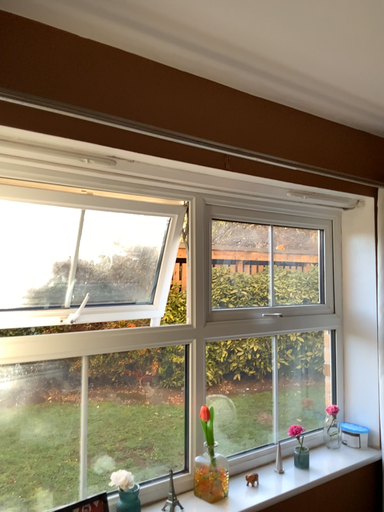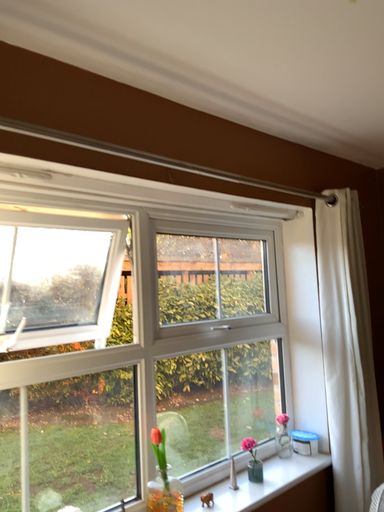
Question: How did the camera likely rotate when shooting the video?

Choices:
 (A) rotated left
 (B) rotated right

Answer: (B)